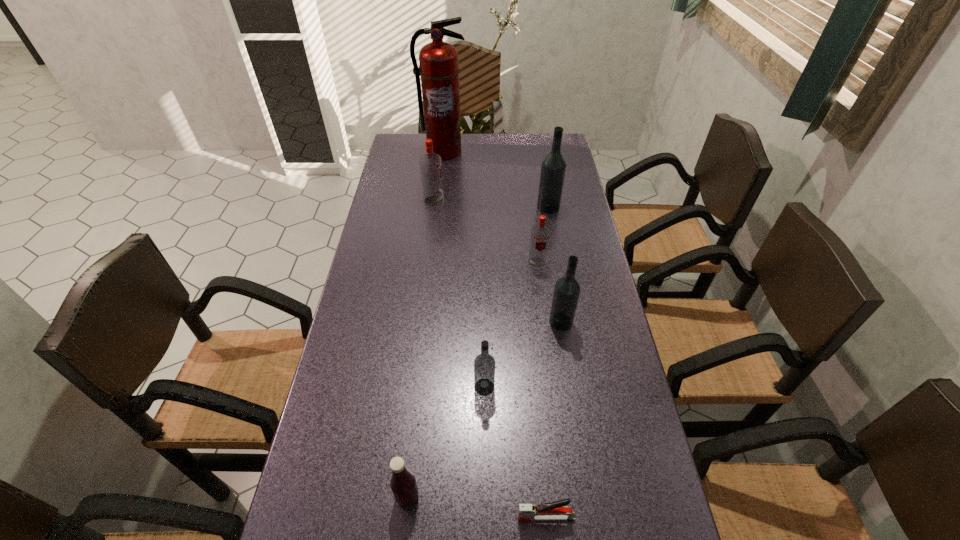
Locate an element on the screen. The width and height of the screenshot is (960, 540). the farthest object is located at coordinates (439, 68).

At what (x,y) coordinates should I click in order to perform the action: click on the tallest object. Please return your answer as a coordinate pair (x, y). This screenshot has width=960, height=540. Looking at the image, I should click on (439, 68).

At what (x,y) coordinates should I click in order to perform the action: click on the second tallest object. Please return your answer as a coordinate pair (x, y). Looking at the image, I should click on (553, 168).

The image size is (960, 540). I want to click on the tallest vodka, so click(553, 168).

Find the location of a particular element. the left red vodka is located at coordinates (430, 163).

Find the location of a particular element. The image size is (960, 540). the leftmost vodka is located at coordinates (430, 163).

Locate an element on the screen. The height and width of the screenshot is (540, 960). the fifth farthest object is located at coordinates (566, 293).

The width and height of the screenshot is (960, 540). In order to click on the fourth farthest vodka in this screenshot , I will do `click(566, 293)`.

The height and width of the screenshot is (540, 960). Identify the location of the smallest black vodka. (484, 364).

Locate an element on the screen. the fourth object from left to right is located at coordinates click(x=484, y=364).